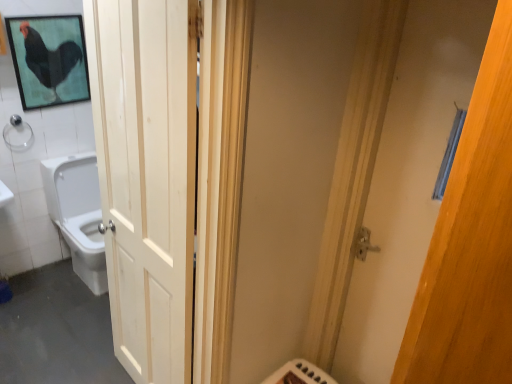
Question: Is clear glass shower at upper left situated inside white glossy toilet at left or outside?

Choices:
 (A) inside
 (B) outside

Answer: (B)

Question: In the image, is clear glass shower at upper left on the left side or the right side of white glossy toilet at left?

Choices:
 (A) left
 (B) right

Answer: (A)

Question: Which is farther from the clear glass shower at upper left?

Choices:
 (A) black matte chicken at upper left
 (B) wooden door at right, which ranks as the 2th door in left-to-right order
 (C) white glossy toilet at left
 (D) white wood door at left, placed as the second door when sorted from right to left

Answer: (B)

Question: Estimate the real-world distances between objects in this image. Which object is farther from the black matte chicken at upper left?

Choices:
 (A) white wood door at left, the 1th door viewed from the left
 (B) wooden door at right, which ranks as the 2th door in left-to-right order
 (C) clear glass shower at upper left
 (D) white glossy toilet at left

Answer: (B)